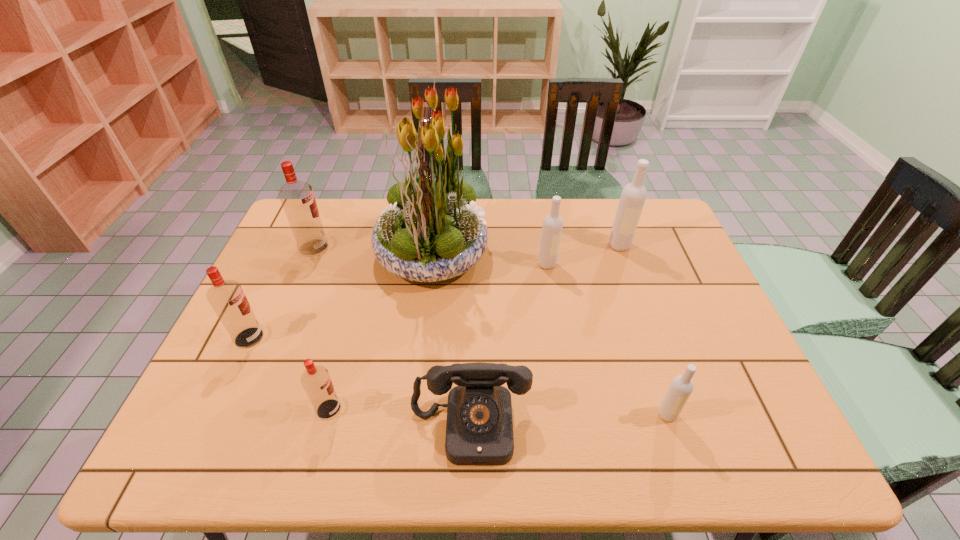
What are the coordinates of `the tallest object` in the screenshot? It's located at (432, 230).

Locate an element on the screen. Image resolution: width=960 pixels, height=540 pixels. the biggest red vodka is located at coordinates (297, 198).

Where is `the farthest white vodka`? Image resolution: width=960 pixels, height=540 pixels. the farthest white vodka is located at coordinates (633, 196).

Locate an element on the screen. The image size is (960, 540). the leftmost white vodka is located at coordinates (552, 227).

You are a GUI agent. You are given a task and a screenshot of the screen. Output one action in this format:
    pyautogui.click(x=<x>, y=<y>)
    Task: Click on the second biggest white vodka
    The height and width of the screenshot is (540, 960).
    Given the screenshot: What is the action you would take?
    pyautogui.click(x=552, y=227)

Where is `the second farthest red vodka`? This screenshot has width=960, height=540. the second farthest red vodka is located at coordinates (226, 297).

You are a GUI agent. You are given a task and a screenshot of the screen. Output one action in this format:
    pyautogui.click(x=<x>, y=<y>)
    Task: Click on the second biggest red vodka
    This screenshot has height=540, width=960.
    Given the screenshot: What is the action you would take?
    pyautogui.click(x=226, y=297)

Locate an element on the screen. This screenshot has height=540, width=960. the smallest red vodka is located at coordinates (316, 381).

I want to click on the fourth vodka from right to left, so click(x=316, y=381).

Find the location of a particular element. This screenshot has height=540, width=960. the smallest white vodka is located at coordinates (681, 387).